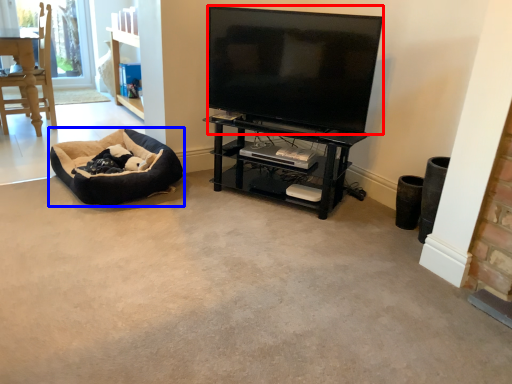
Question: Among these objects, which one is nearest to the camera, television (highlighted by a red box) or dog bed (highlighted by a blue box)?

Choices:
 (A) television
 (B) dog bed

Answer: (A)